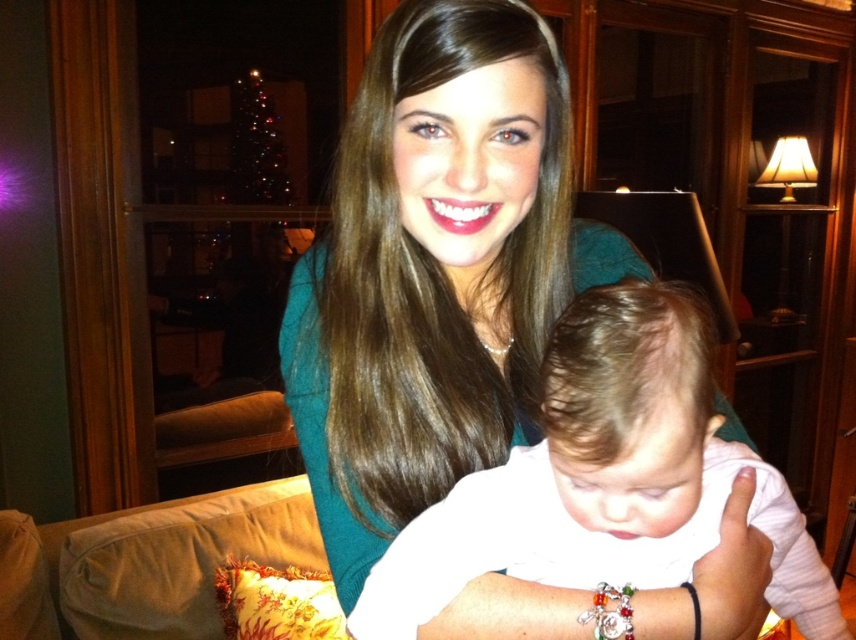
Question: Among these points, which one is farthest from the camera?

Choices:
 (A) (461, 333)
 (B) (679, 440)

Answer: (A)

Question: In this image, where is matte teal sweater at center located relative to white soft baby at center?

Choices:
 (A) right
 (B) left

Answer: (B)

Question: Is matte teal sweater at center behind white soft baby at center?

Choices:
 (A) yes
 (B) no

Answer: (A)

Question: Is matte teal sweater at center further to the viewer compared to white soft baby at center?

Choices:
 (A) yes
 (B) no

Answer: (A)

Question: Which point is farther to the camera?

Choices:
 (A) matte teal sweater at center
 (B) white soft baby at center

Answer: (A)